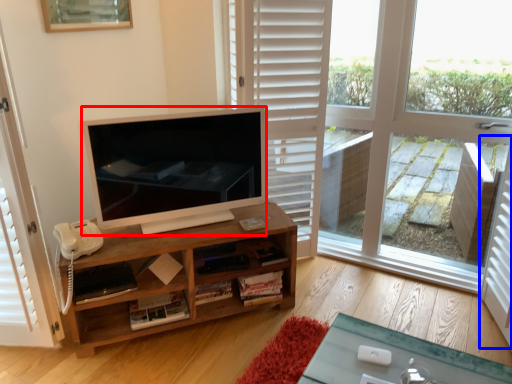
Question: Which point is further to the camera, television (highlighted by a red box) or screen door (highlighted by a blue box)?

Choices:
 (A) television
 (B) screen door

Answer: (A)